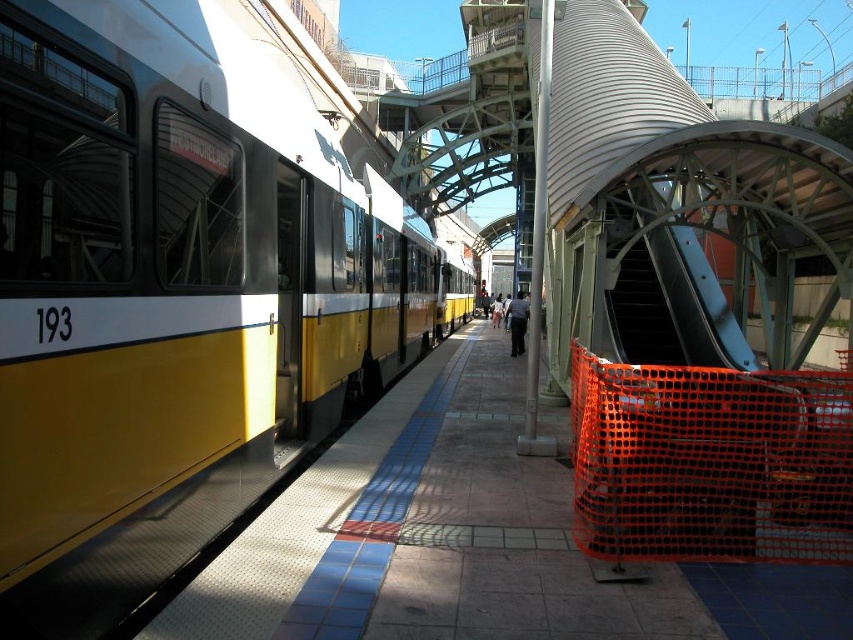
Which is more to the right, yellow matte train at left or black uniform at center?

From the viewer's perspective, black uniform at center appears more on the right side.

Does point (213, 176) come farther from viewer compared to point (527, 317)?

No, it is in front of (527, 317).

Where is `yellow matte train at left`? The width and height of the screenshot is (853, 640). yellow matte train at left is located at coordinates (177, 268).